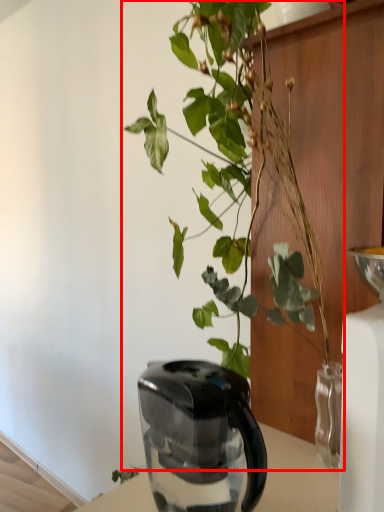
Question: From the image's perspective, what is the correct spatial relationship of houseplant (annotated by the red box) in relation to kettle?

Choices:
 (A) below
 (B) above

Answer: (B)